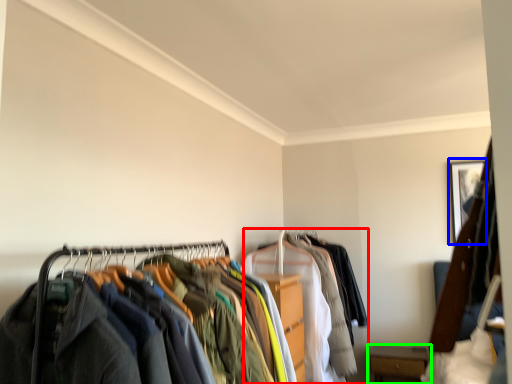
Question: Which object is positioned farthest from garment (highlighted by a red box)? Select from picture frame (highlighted by a blue box) and furniture (highlighted by a green box).

Choices:
 (A) picture frame
 (B) furniture

Answer: (A)